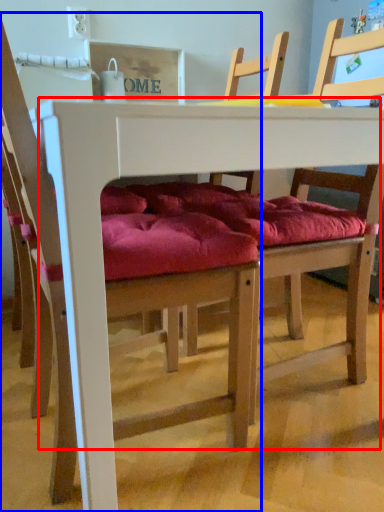
Question: Among these objects, which one is nearest to the camera, table (highlighted by a red box) or chair (highlighted by a blue box)?

Choices:
 (A) table
 (B) chair

Answer: (B)